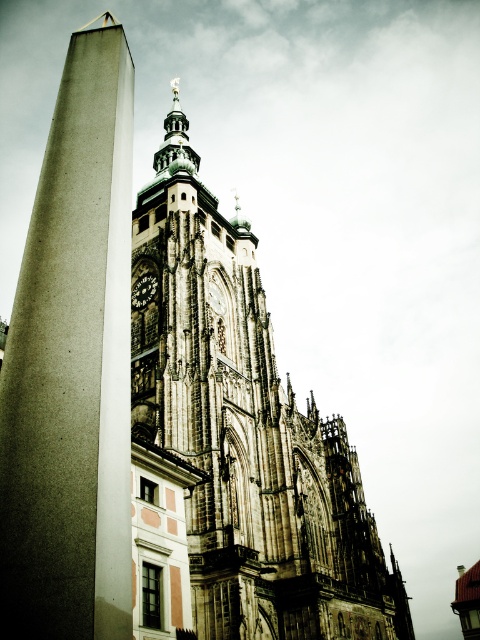
You are standing in front of the cathedral and want to take a photo of the brown stone tower at center. If your camera can focus on objects up to 60 meters away, will it be able to capture the tower clearly?

The brown stone tower at center and camera are 57.96 meters apart from each other, which is within the camera focus range of up to 60 meters. Therefore, the camera can capture the tower clearly.

You are an architect designing a new building that needs to be placed between the brown stone tower at center and the dark gray stone clock at upper center. Which object should you consider for the height of your new building to ensure it doesn

The brown stone tower at center is larger in size than the dark gray stone clock at upper center. Therefore, you should consider the height of the brown stone tower at center to ensure your new building fits appropriately between them.

You are standing at the entrance of the cathedral and want to take a photo of the brown stone tower at center. What are the coordinates where you should aim your camera?

The coordinates for the brown stone tower at center are point (245, 433).